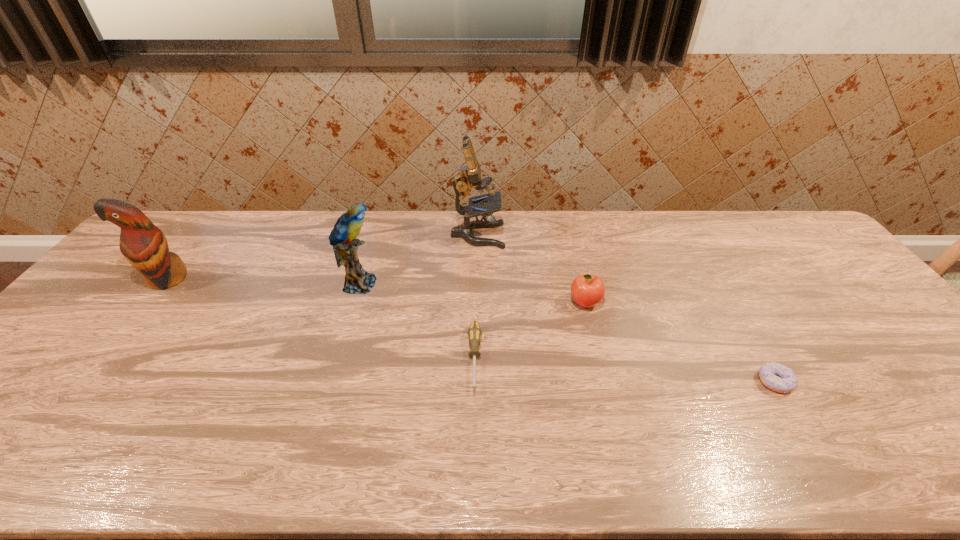
I want to click on the tallest object, so click(x=469, y=176).

Find the location of a particular element. The width and height of the screenshot is (960, 540). the farthest object is located at coordinates (469, 176).

Locate an element on the screen. This screenshot has height=540, width=960. the leftmost object is located at coordinates (144, 245).

Locate an element on the screen. Image resolution: width=960 pixels, height=540 pixels. the second object from left to right is located at coordinates tap(343, 236).

You are a GUI agent. You are given a task and a screenshot of the screen. Output one action in this format:
    pyautogui.click(x=<x>, y=<y>)
    Task: Click on the third shortest object
    The image size is (960, 540).
    Given the screenshot: What is the action you would take?
    pyautogui.click(x=587, y=290)

Locate an element on the screen. The height and width of the screenshot is (540, 960). apple is located at coordinates (587, 290).

Where is `screwdriver`? This screenshot has width=960, height=540. screwdriver is located at coordinates point(474,333).

Where is `the rightmost object`? Image resolution: width=960 pixels, height=540 pixels. the rightmost object is located at coordinates (775, 376).

This screenshot has height=540, width=960. Find the location of `vacant space located 0.190m at the eyepieces of the microscope`. vacant space located 0.190m at the eyepieces of the microscope is located at coordinates (561, 235).

This screenshot has width=960, height=540. What are the coordinates of `vacant region located on the face of the leftmost object` in the screenshot? It's located at (102, 362).